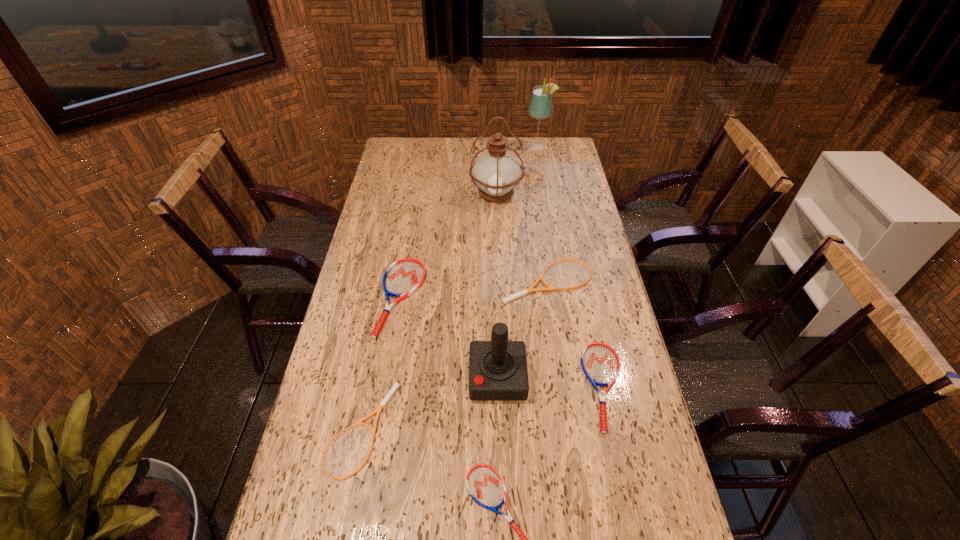
Find the location of a particular element. The image size is (960, 540). blank area located on the right of the left beige tennis racket is located at coordinates (551, 431).

This screenshot has width=960, height=540. What are the coordinates of `object at the far edge` in the screenshot? It's located at (540, 105).

This screenshot has width=960, height=540. What are the coordinates of `alcohol present at the right edge` in the screenshot? It's located at (540, 105).

You are a GUI agent. You are given a task and a screenshot of the screen. Output one action in this format:
    pyautogui.click(x=<x>, y=<y>)
    Task: Click on the object located in the far right corner section of the desktop
    
    Given the screenshot: What is the action you would take?
    pyautogui.click(x=540, y=105)

I want to click on vacant space at the far edge, so click(517, 142).

The image size is (960, 540). Find the location of `vacant space at the left edge of the desktop`. vacant space at the left edge of the desktop is located at coordinates (348, 301).

This screenshot has width=960, height=540. In order to click on vacant space at the right edge of the desktop in this screenshot , I will do `click(588, 285)`.

In the image, there is a desktop. Identify the location of blank space at the far left corner. (409, 147).

Image resolution: width=960 pixels, height=540 pixels. I want to click on vacant space that's between the biggest blue tennis racket and the alcohol, so click(469, 222).

The image size is (960, 540). Find the location of `vacant space that's between the farther beige tennis racket and the nearer beige tennis racket`. vacant space that's between the farther beige tennis racket and the nearer beige tennis racket is located at coordinates (454, 355).